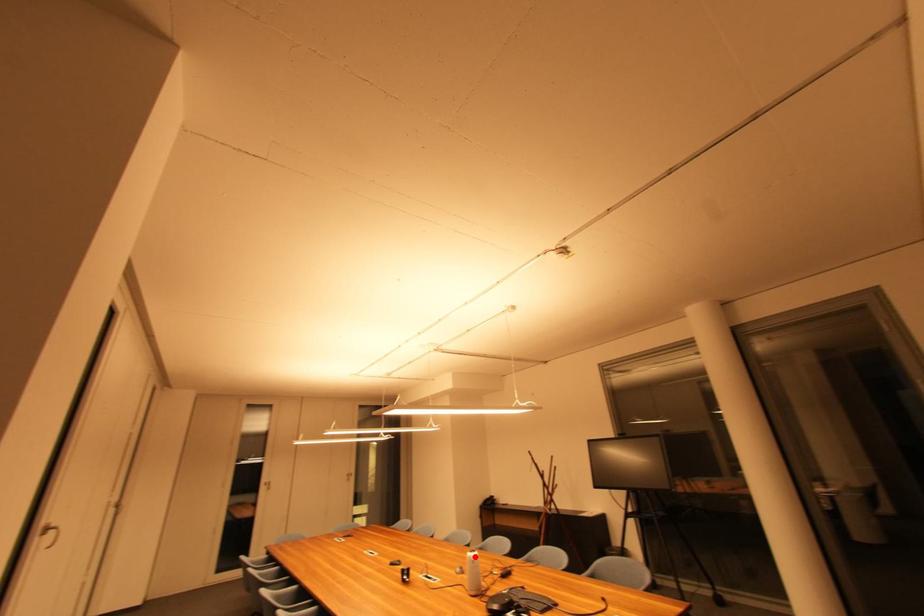
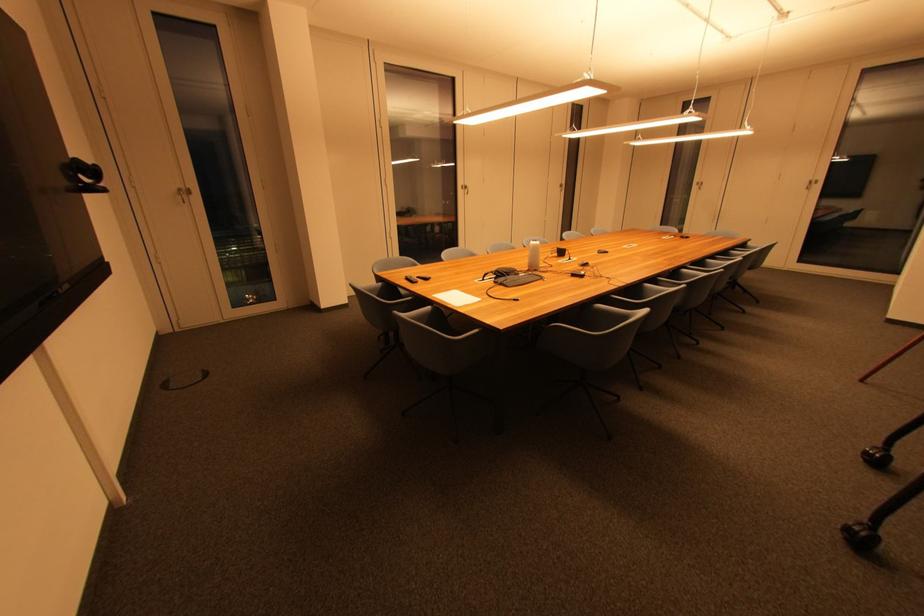
Question: A red point is marked in image1. In image2, is the corresponding 3D point closer to the camera or farther? Reply with the corresponding letter.

Choices:
 (A) The corresponding 3D point is closer.
 (B) The corresponding 3D point is farther.

Answer: (B)